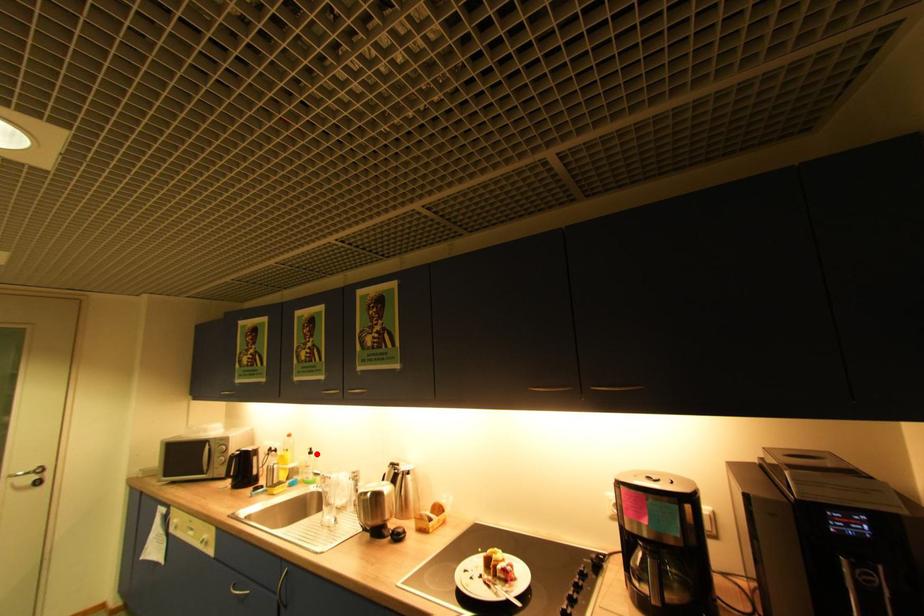
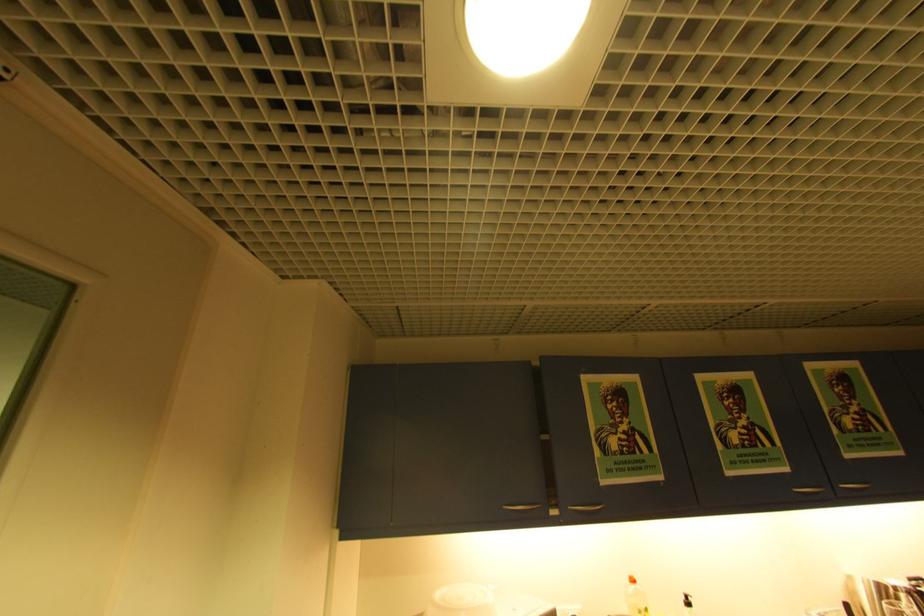
The point at the highlighted location is marked in the first image. Where is the corresponding point in the second image?

(695, 605)